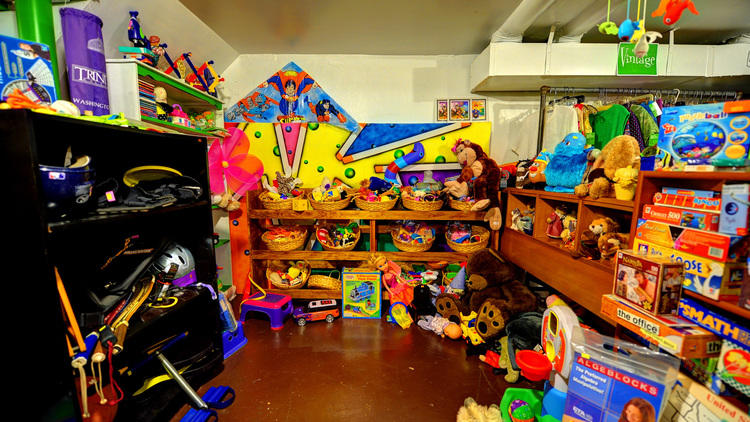
Locate an element on the screen. Image resolution: width=750 pixels, height=422 pixels. step stool is located at coordinates (274, 302).